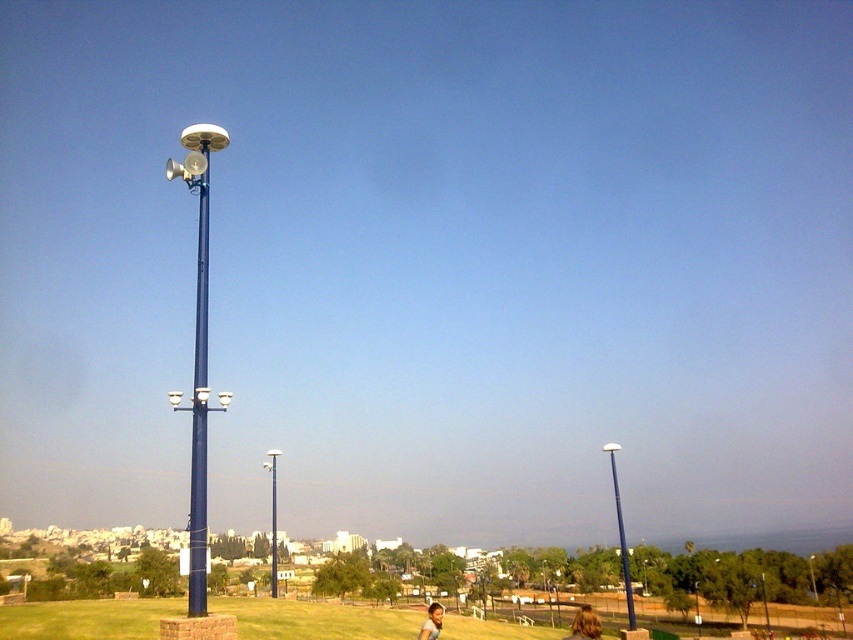
Question: Is smooth skin face at lower center closer to the viewer compared to metallic silver pole at right?

Choices:
 (A) yes
 (B) no

Answer: (A)

Question: Is metallic pole at center wider than metallic silver pole at right?

Choices:
 (A) yes
 (B) no

Answer: (B)

Question: Which object appears farthest from the camera in this image?

Choices:
 (A) metallic blue pole at left
 (B) blue metallic pole at right
 (C) smooth skin face at lower center
 (D) metallic pole at center

Answer: (D)

Question: Estimate the real-world distances between objects in this image. Which object is closer to the blue metallic pole at right?

Choices:
 (A) metallic pole at center
 (B) blue metallic pole at center

Answer: (A)

Question: Which point is farther to the camera?

Choices:
 (A) blue metallic pole at right
 (B) metallic pole at center

Answer: (B)

Question: Can you confirm if metallic blue pole at left is wider than blonde hair at lower center?

Choices:
 (A) no
 (B) yes

Answer: (B)